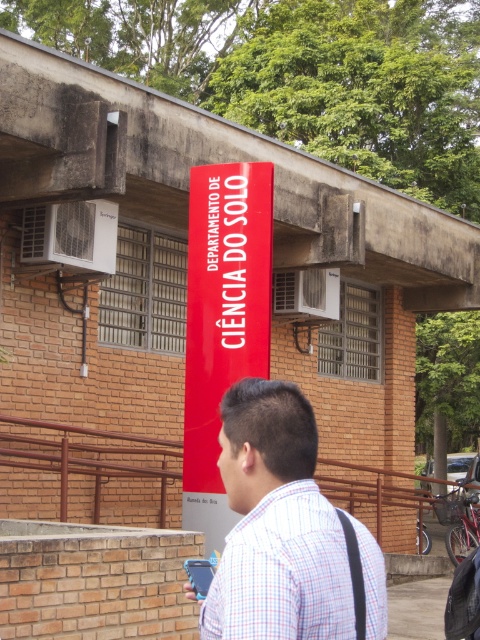
Consider the image. You are a visitor at the building entrance and notice the plaid shirt at center and the matte red sign at center. Which object is taller when viewed from the front?

The matte red sign at center is taller than the plaid shirt at center.

You are standing at the entrance of the building and want to touch both the plaid shirt at center and the matte red sign at center. Which object is closer to you?

The plaid shirt at center is 15.72 feet away from the matte red sign at center. Since you are at the entrance, the plaid shirt at center is closer to you than the matte red sign at center.

You are standing in front of the building and see the plaid shirt at center and the matte red sign at center. Which object is located to the right of the other?

The plaid shirt at center is positioned on the right side of matte red sign at center.